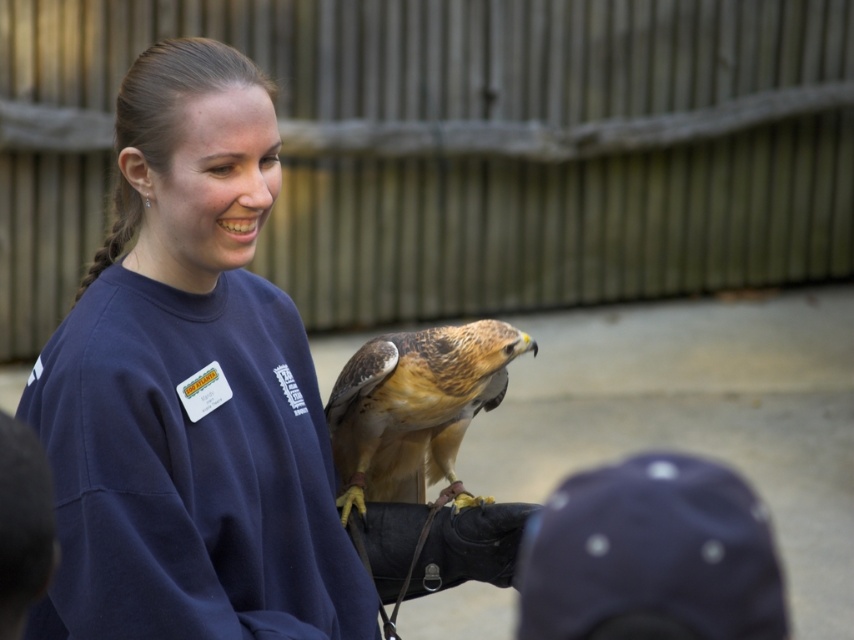
Can you confirm if navy blue sweatshirt at center is positioned above brown feathered falcon at center?

Indeed, navy blue sweatshirt at center is positioned over brown feathered falcon at center.

Can you confirm if navy blue sweatshirt at center is wider than brown feathered falcon at center?

Correct, the width of navy blue sweatshirt at center exceeds that of brown feathered falcon at center.

Between point (272, 480) and point (344, 444), which one is positioned in front?

Point (272, 480) is more forward.

This screenshot has width=854, height=640. I want to click on navy blue sweatshirt at center, so click(x=190, y=390).